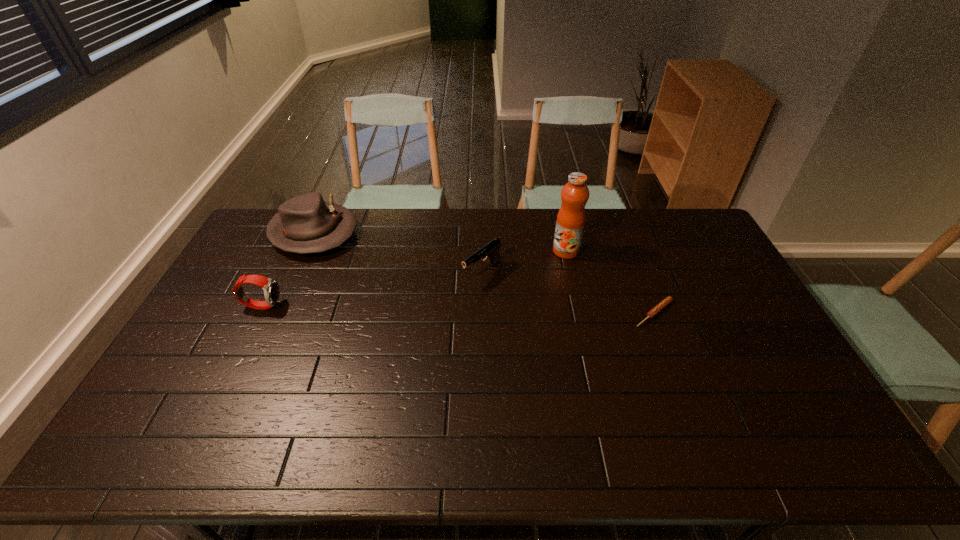
Find the location of a particular element. watch is located at coordinates (271, 289).

You are a GUI agent. You are given a task and a screenshot of the screen. Output one action in this format:
    pyautogui.click(x=<x>, y=<y>)
    Task: Click on the rightmost object
    
    Given the screenshot: What is the action you would take?
    pyautogui.click(x=664, y=303)

This screenshot has width=960, height=540. I want to click on sausage, so click(664, 303).

Image resolution: width=960 pixels, height=540 pixels. What are the coordinates of `the second object from right to left` in the screenshot? It's located at (571, 217).

This screenshot has height=540, width=960. I want to click on the tallest object, so click(x=571, y=217).

Where is `hat`? The width and height of the screenshot is (960, 540). hat is located at coordinates (305, 224).

What are the coordinates of `the third object from left to right` in the screenshot? It's located at (491, 249).

I want to click on free space located on the face of the watch, so click(373, 305).

The image size is (960, 540). Find the location of `vacant area situated on the front of the shortest object`. vacant area situated on the front of the shortest object is located at coordinates (678, 374).

Locate an element on the screen. The image size is (960, 540). vacant space located on the front label of the fourth object from left to right is located at coordinates (542, 264).